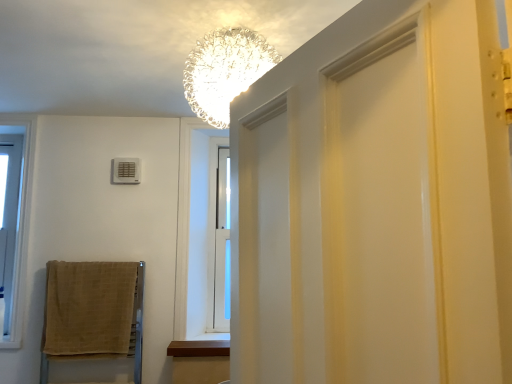
What do you see at coordinates (91, 310) in the screenshot?
I see `beige woven towel at lower left` at bounding box center [91, 310].

Find the location of `clear glass chandelier at upper center`. clear glass chandelier at upper center is located at coordinates (224, 71).

Measure the distance between point (206, 352) and camera.

2.30 meters.

In order to face brown wood at lower center, should I rotate leftwards or rightwards?

To face it directly, rotate left by 7.496 degrees.

Identify the location of clear glass window at left. (8, 223).

How many degrees apart are the facing directions of clear glass window at left and beige woven towel at lower left?

0.376 degrees separate the facing orientations of clear glass window at left and beige woven towel at lower left.

Is clear glass window at left positioned far away from beige woven towel at lower left?

No.

Which is more distant, (1, 284) or (52, 317)?

The point (1, 284) is farther from the camera.

Is clear glass window at left taller than beige woven towel at lower left?

Yes, clear glass window at left is taller than beige woven towel at lower left.

Is white plastic air conditioner at upper left inside or outside of clear glass window at left?

The correct answer is: outside.

Between white plastic air conditioner at upper left and clear glass window at left, which one is positioned behind?

white plastic air conditioner at upper left.

Which point is more forward, (118,179) or (1,288)?

The point (1,288) is in front.

Can you confirm if white plastic air conditioner at upper left is shorter than clear glass window at left?

Correct, white plastic air conditioner at upper left is not as tall as clear glass window at left.

Is white plastic air conditioner at upper left aimed at beige woven towel at lower left?

No.

Measure the distance between white plastic air conditioner at upper left and beige woven towel at lower left.

The distance of white plastic air conditioner at upper left from beige woven towel at lower left is 28.89 inches.

From the picture: Considering the relative sizes of white plastic air conditioner at upper left and beige woven towel at lower left in the image provided, is white plastic air conditioner at upper left shorter than beige woven towel at lower left?

Yes, white plastic air conditioner at upper left is shorter than beige woven towel at lower left.

Does point (124, 159) lie behind point (140, 331)?

Yes.

In the image, is beige woven towel at lower left positioned in front of or behind clear glass chandelier at upper center?

beige woven towel at lower left is positioned farther from the viewer than clear glass chandelier at upper center.

Is point (50, 263) in front of point (264, 52)?

No.

Is beige woven towel at lower left shorter than clear glass chandelier at upper center?

In fact, beige woven towel at lower left may be taller than clear glass chandelier at upper center.

What are the coordinates of `window sill that is on the right side of beige woven towel at lower left` in the screenshot? It's located at (199, 348).

Is point (76, 338) positioned in front of point (194, 352)?

No, (76, 338) is further to viewer.

Can you tell me how much beige woven towel at lower left and brown wood at lower center differ in facing direction?

There is a 0.0361-degree angle between the facing directions of beige woven towel at lower left and brown wood at lower center.

From a real-world perspective, is beige woven towel at lower left positioned above or below brown wood at lower center?

From a real-world perspective, beige woven towel at lower left is physically above brown wood at lower center.

You are a GUI agent. You are given a task and a screenshot of the screen. Output one action in this format:
    pyautogui.click(x=<x>, y=<y>)
    Task: Click on the window sill that is behind the beige woven towel at lower left
    The height and width of the screenshot is (384, 512).
    Given the screenshot: What is the action you would take?
    pyautogui.click(x=199, y=348)

From the image's perspective, is brown wood at lower center beneath beige woven towel at lower left?

Indeed, from the image's perspective, brown wood at lower center is shown beneath beige woven towel at lower left.

Is point (195, 353) positioned after point (112, 279)?

No, it is in front of (112, 279).

Is brown wood at lower center outside of beige woven towel at lower left?

Yes.

I want to click on air conditioner below the clear glass chandelier at upper center (from a real-world perspective), so click(x=126, y=170).

Is white plastic air conditioner at upper left smaller than clear glass chandelier at upper center?

Indeed, white plastic air conditioner at upper left has a smaller size compared to clear glass chandelier at upper center.

What's the angular difference between white plastic air conditioner at upper left and clear glass chandelier at upper center's facing directions?

2.08 degrees.

In the scene shown: Are white plastic air conditioner at upper left and clear glass chandelier at upper center located far from each other?

Absolutely, white plastic air conditioner at upper left is distant from clear glass chandelier at upper center.

At what (x,y) coordinates should I click in order to perform the action: click on window behind the beige woven towel at lower left. Please return your answer as a coordinate pair (x, y). The image size is (512, 384). Looking at the image, I should click on (8, 223).

The image size is (512, 384). Find the location of `window in front of the white plastic air conditioner at upper left`. window in front of the white plastic air conditioner at upper left is located at coordinates (8, 223).

When comparing their distances from clear glass window at left, does clear glass chandelier at upper center or white plastic air conditioner at upper left seem closer?

white plastic air conditioner at upper left.

Considering their positions, is beige woven towel at lower left positioned further to clear glass window at left than brown wood at lower center?

The object further to clear glass window at left is brown wood at lower center.

Estimate the real-world distances between objects in this image. Which object is further from clear glass chandelier at upper center, clear glass window at left or beige woven towel at lower left?

clear glass window at left is further to clear glass chandelier at upper center.

Looking at the image, which one is located further to clear glass window at left, white plastic air conditioner at upper left or beige woven towel at lower left?

Based on the image, white plastic air conditioner at upper left appears to be further to clear glass window at left.

Based on their spatial positions, is brown wood at lower center or clear glass chandelier at upper center further from clear glass window at left?

clear glass chandelier at upper center.

Looking at the image, which one is located further to white plastic air conditioner at upper left, beige woven towel at lower left or brown wood at lower center?

The object further to white plastic air conditioner at upper left is brown wood at lower center.

Consider the image. Which object lies nearer to the anchor point beige woven towel at lower left, clear glass chandelier at upper center or white plastic air conditioner at upper left?

The object closer to beige woven towel at lower left is white plastic air conditioner at upper left.

Looking at the image, which one is located closer to beige woven towel at lower left, brown wood at lower center or clear glass window at left?

The object closer to beige woven towel at lower left is brown wood at lower center.

Locate an element on the screen. This screenshot has height=384, width=512. bath towel between clear glass window at left and clear glass chandelier at upper center in the horizontal direction is located at coordinates (91, 310).

Find the location of a particular element. bath towel situated between clear glass window at left and brown wood at lower center from left to right is located at coordinates (91, 310).

At what (x,y) coordinates should I click in order to perform the action: click on window between white plastic air conditioner at upper left and beige woven towel at lower left from top to bottom. Please return your answer as a coordinate pair (x, y). Looking at the image, I should click on (8, 223).

You are a GUI agent. You are given a task and a screenshot of the screen. Output one action in this format:
    pyautogui.click(x=<x>, y=<y>)
    Task: Click on the window sill situated between clear glass window at left and clear glass chandelier at upper center from left to right
    Image resolution: width=512 pixels, height=384 pixels.
    Given the screenshot: What is the action you would take?
    pyautogui.click(x=199, y=348)